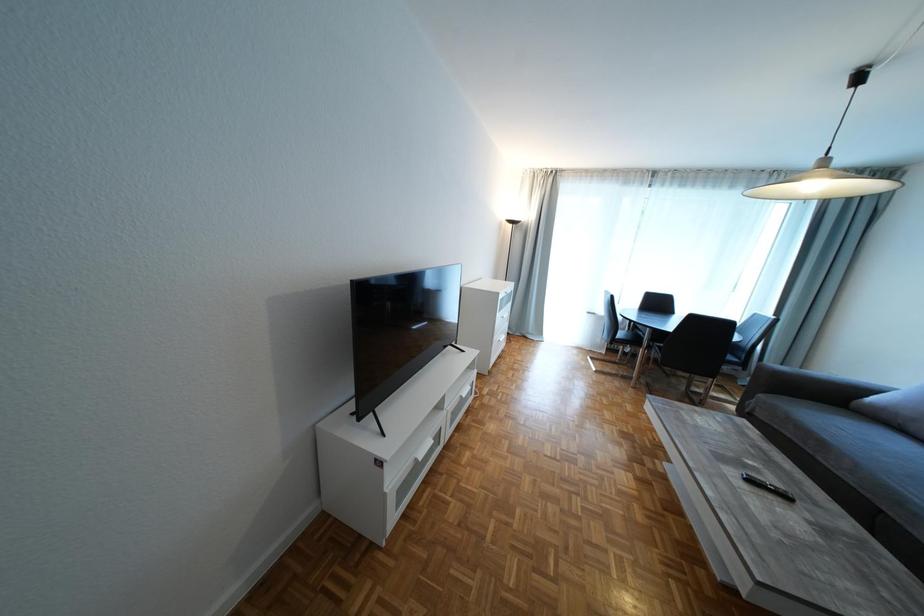
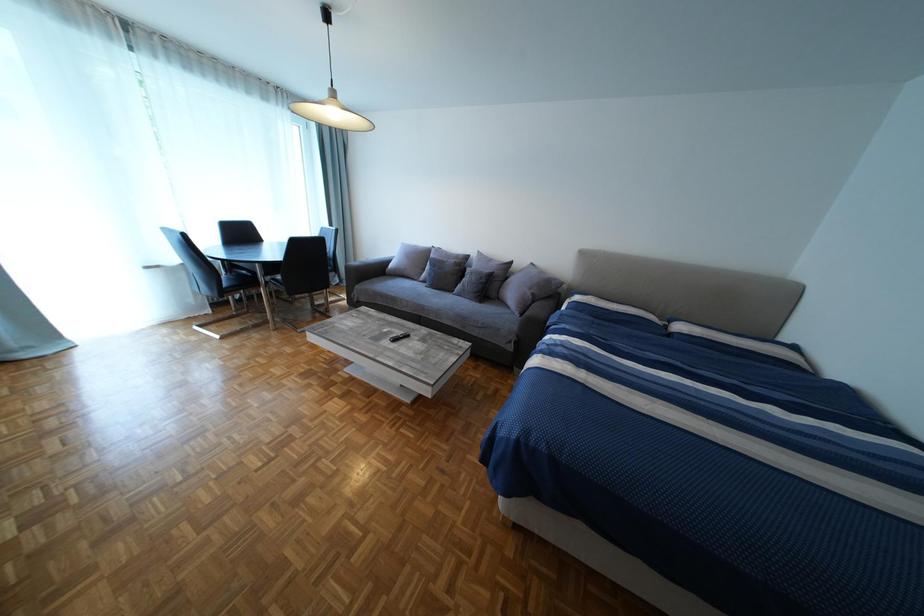
First-person continuous shooting, in which direction is the camera rotating?

The camera rotated toward right-down.